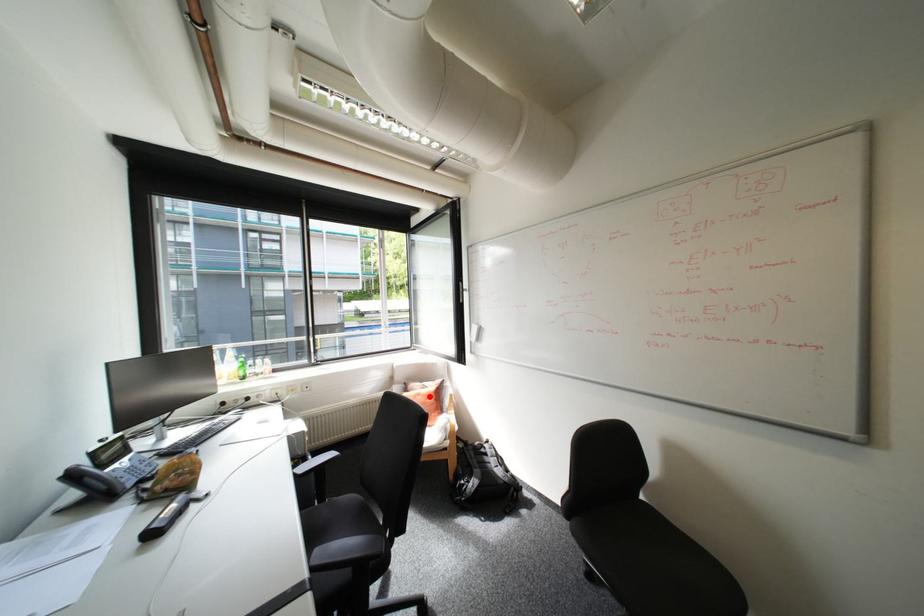
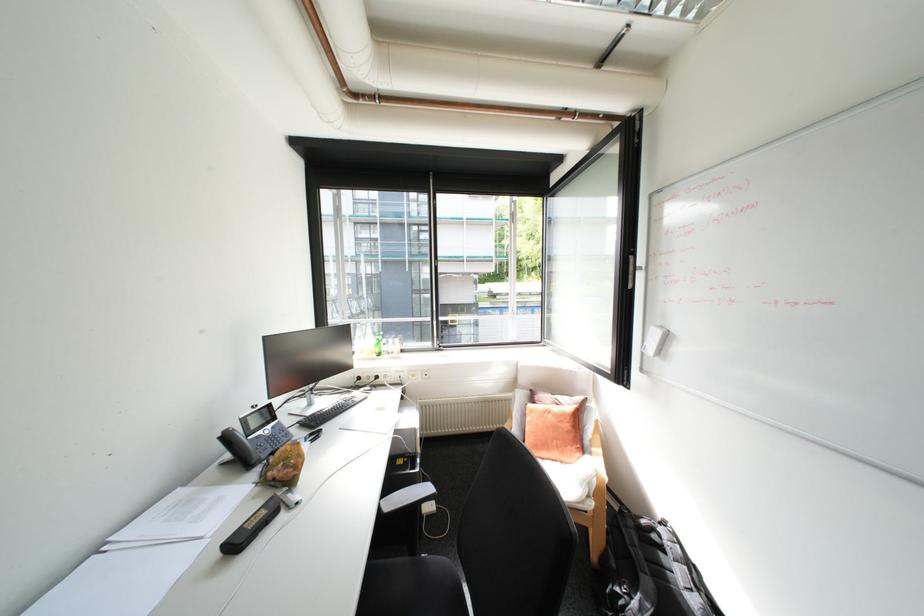
Find the pixel in the second image that matches the highlighted location in the first image.

(561, 416)